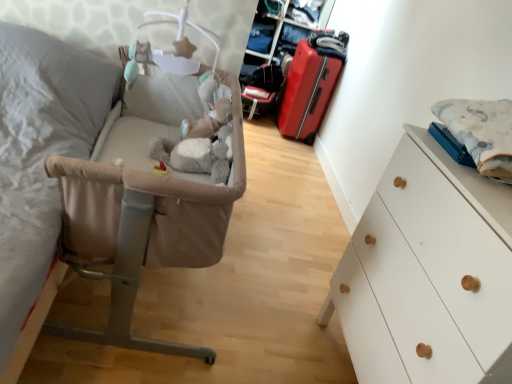
The height and width of the screenshot is (384, 512). Find the location of `free area below beige fabric infant bed at left (from a real-world perspective)`. free area below beige fabric infant bed at left (from a real-world perspective) is located at coordinates (160, 295).